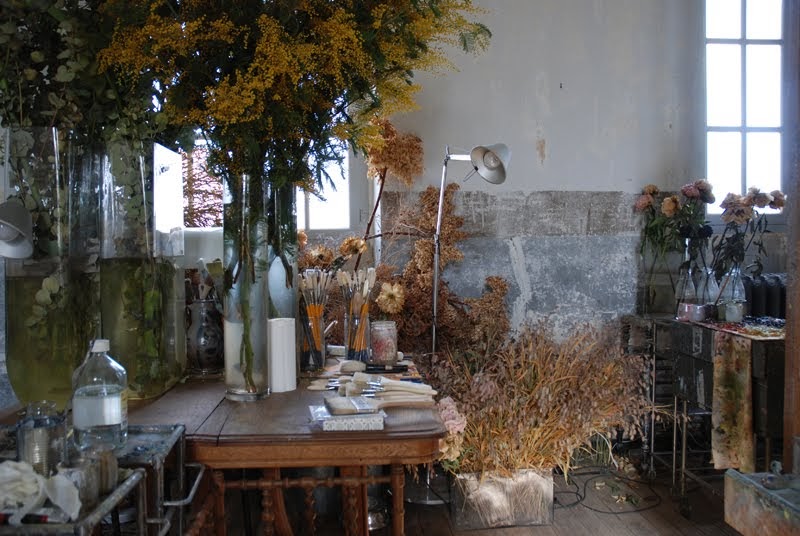
You are a GUI agent. You are given a task and a screenshot of the screen. Output one action in this format:
    pyautogui.click(x=<x>, y=<y>)
    Task: Click on the lamp
    This screenshot has height=536, width=800.
    Given the screenshot: What is the action you would take?
    pyautogui.click(x=488, y=166)